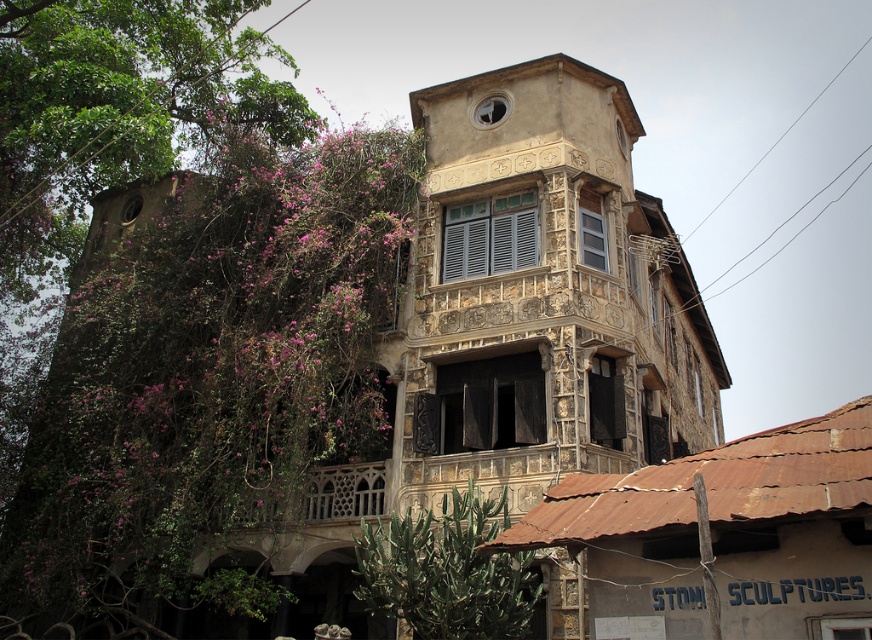
You are standing in front of the building and notice two points marked on its facade. The first point is at coordinates point (192, 202) and the second is at point (244, 509). Which of these points is closer to you?

Point (192, 202) is further to the camera than point (244, 509), so the point closer to you is point (244, 509).

You are standing in front of the building and want to know which object is higher between the green leafy tree at left and the carved stone balcony at center. Can you tell me?

The green leafy tree at left is taller than the carved stone balcony at center.

You are standing at point (208, 378) in the image. What do you see there?

At point (208, 378) lies green leafy tree at left.